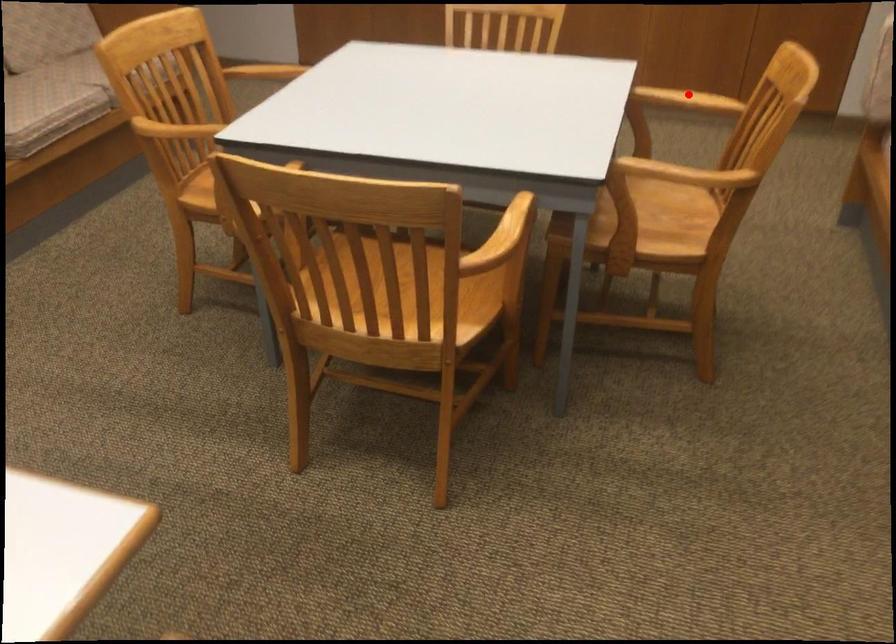
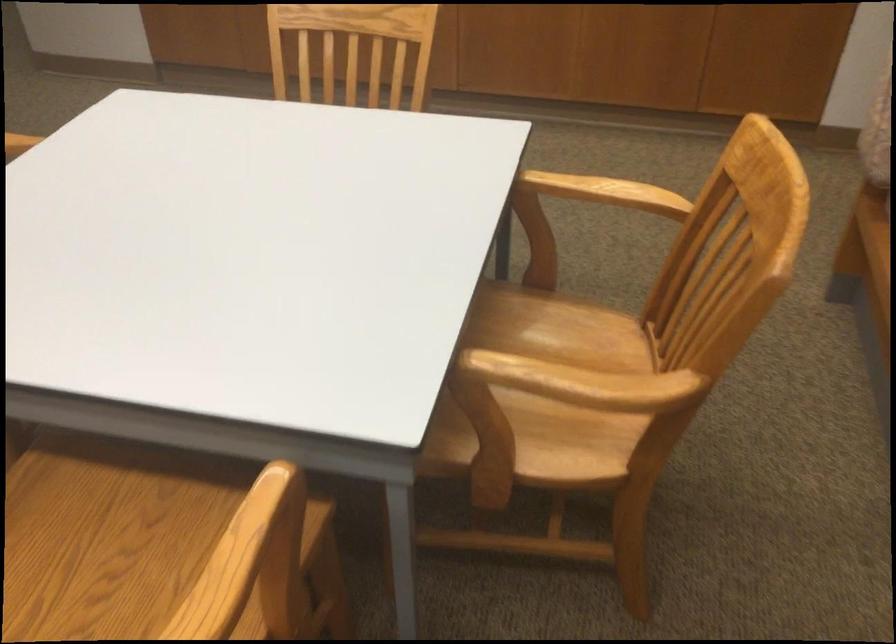
Find the pixel in the second image that matches the highlighted location in the first image.

(605, 192)